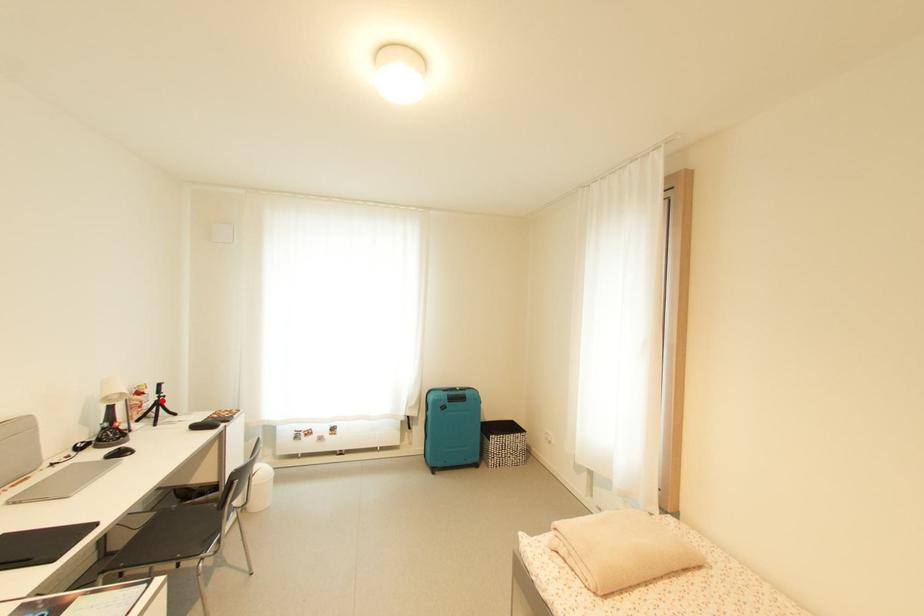
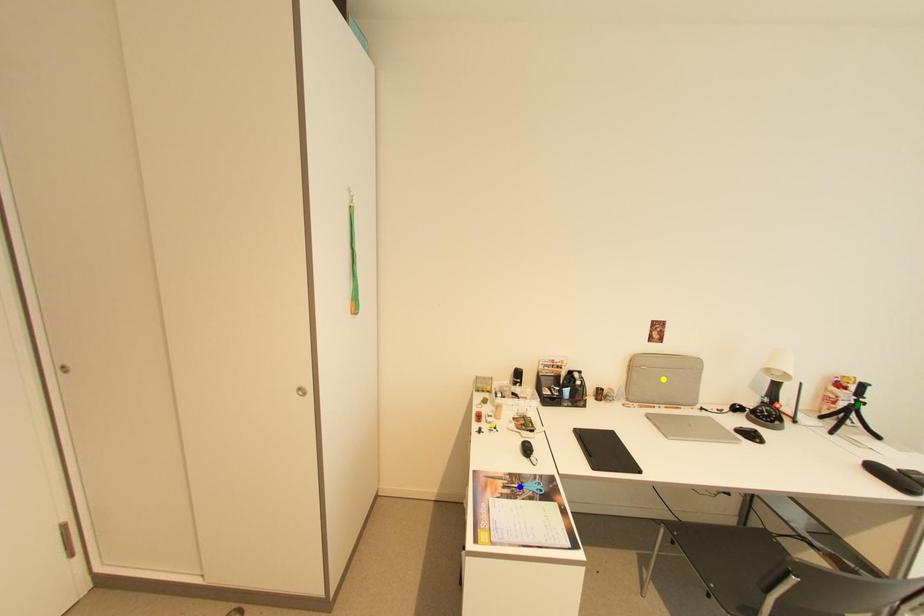
Question: I am providing you with two images of the same scene from different viewpoints. A red point is marked on the first image. You are given multiple points on the second image. Which point in image 2 is actually the same real-world point as the red point in image 1?

Choices:
 (A) blue point
 (B) yellow point
 (C) green point

Answer: (C)